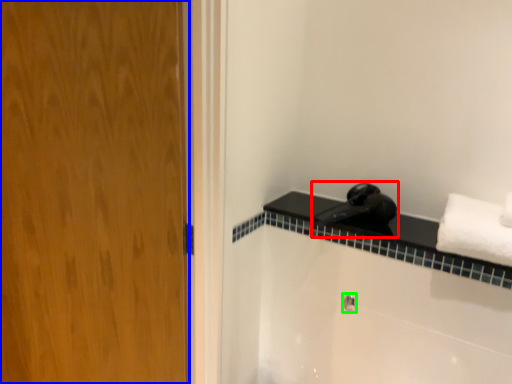
Question: Estimate the real-world distances between objects in this image. Which object is closer to faucet (highlighted by a red box), door (highlighted by a blue box) or shower (highlighted by a green box)?

Choices:
 (A) door
 (B) shower

Answer: (B)